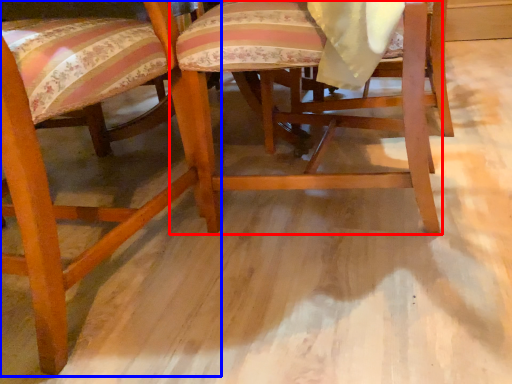
Question: Which object appears farthest to the camera in this image, chair (highlighted by a red box) or chair (highlighted by a blue box)?

Choices:
 (A) chair
 (B) chair

Answer: (A)